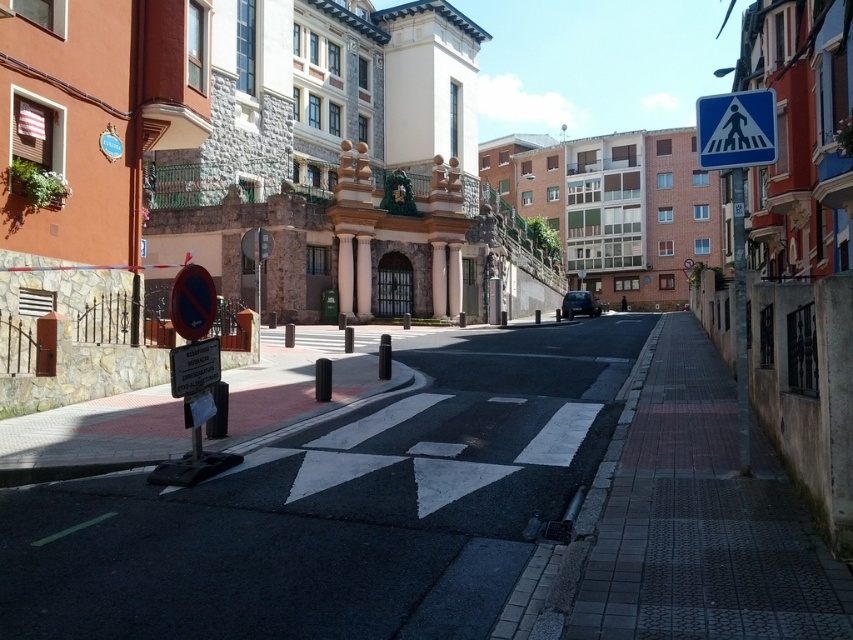
Can you confirm if white plastic pedestrian crossing sign at upper right is positioned to the right of dark gray metallic car at center?

In fact, white plastic pedestrian crossing sign at upper right is to the left of dark gray metallic car at center.

Measure the distance between white plastic pedestrian crossing sign at upper right and dark gray metallic car at center.

They are 20.56 meters apart.

Locate an element on the screen. Image resolution: width=853 pixels, height=640 pixels. white plastic pedestrian crossing sign at upper right is located at coordinates (735, 129).

I want to click on white plastic pedestrian crossing sign at upper right, so click(x=735, y=129).